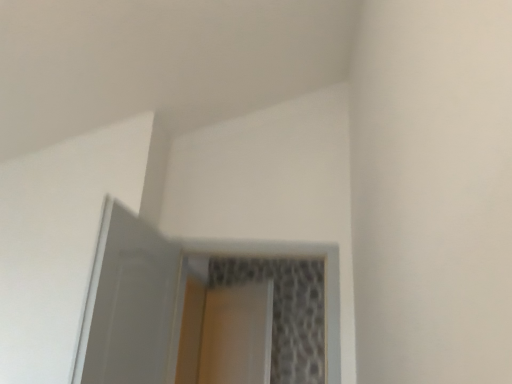
Question: Is clear glass screen door at center, the 2th screen door viewed from the front, outside of white glossy door at upper left, which is the first screen door in front-to-back order?

Choices:
 (A) yes
 (B) no

Answer: (A)

Question: From a real-world perspective, is clear glass screen door at center, the 2th screen door viewed from the front, physically below white glossy door at upper left, acting as the second screen door starting from the back?

Choices:
 (A) no
 (B) yes

Answer: (B)

Question: Can you confirm if clear glass screen door at center, the 2th screen door viewed from the front, is bigger than white glossy door at upper left, acting as the second screen door starting from the back?

Choices:
 (A) no
 (B) yes

Answer: (A)

Question: Considering the relative positions of clear glass screen door at center, acting as the 1th screen door starting from the back, and white glossy door at upper left, which is the first screen door in front-to-back order, in the image provided, is clear glass screen door at center, acting as the 1th screen door starting from the back, to the right of white glossy door at upper left, which is the first screen door in front-to-back order, from the viewer's perspective?

Choices:
 (A) yes
 (B) no

Answer: (A)

Question: Is clear glass screen door at center, acting as the 1th screen door starting from the back, in contact with white glossy door at upper left, acting as the second screen door starting from the back?

Choices:
 (A) yes
 (B) no

Answer: (B)

Question: Does clear glass screen door at center, acting as the 1th screen door starting from the back, have a lesser height compared to white glossy door at upper left, acting as the second screen door starting from the back?

Choices:
 (A) no
 (B) yes

Answer: (A)

Question: Can you confirm if white glossy door at upper left, acting as the second screen door starting from the back, is thinner than clear glass screen door at center, the 2th screen door viewed from the front?

Choices:
 (A) no
 (B) yes

Answer: (A)

Question: From a real-world perspective, is white glossy door at upper left, which is the first screen door in front-to-back order, on top of clear glass screen door at center, acting as the 1th screen door starting from the back?

Choices:
 (A) yes
 (B) no

Answer: (A)

Question: Is clear glass screen door at center, acting as the 1th screen door starting from the back, a part of white glossy door at upper left, acting as the second screen door starting from the back?

Choices:
 (A) no
 (B) yes

Answer: (A)

Question: Is white glossy door at upper left, which is the first screen door in front-to-back order, oriented away from clear glass screen door at center, acting as the 1th screen door starting from the back?

Choices:
 (A) yes
 (B) no

Answer: (B)

Question: From a real-world perspective, is white glossy door at upper left, acting as the second screen door starting from the back, beneath clear glass screen door at center, the 2th screen door viewed from the front?

Choices:
 (A) no
 (B) yes

Answer: (A)

Question: Can we say white glossy door at upper left, acting as the second screen door starting from the back, lies outside clear glass screen door at center, acting as the 1th screen door starting from the back?

Choices:
 (A) yes
 (B) no

Answer: (A)

Question: Considering the positions of clear glass screen door at center, acting as the 1th screen door starting from the back, and white glossy door at upper left, which is the first screen door in front-to-back order, in the image, is clear glass screen door at center, acting as the 1th screen door starting from the back, taller or shorter than white glossy door at upper left, which is the first screen door in front-to-back order,?

Choices:
 (A) short
 (B) tall

Answer: (B)